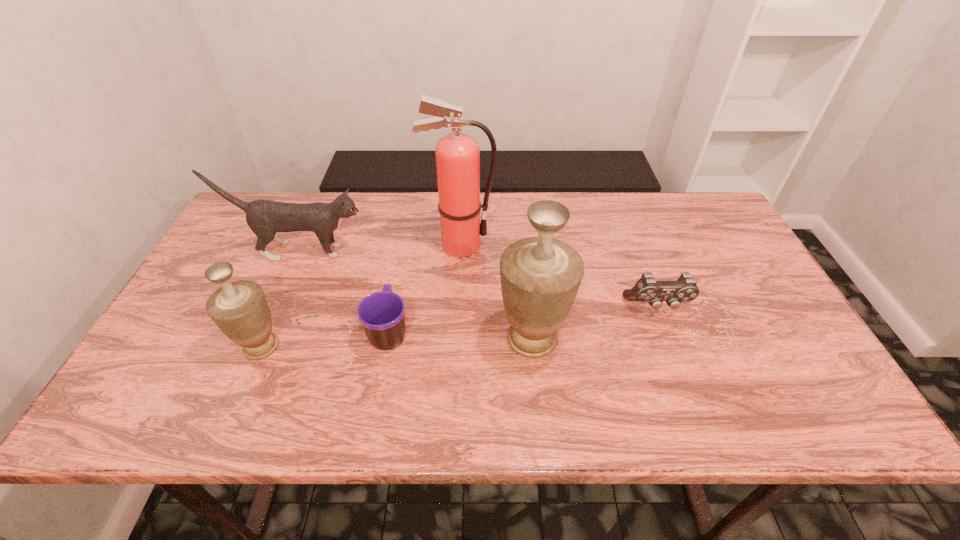
Identify the location of blank area at the left edge. The image size is (960, 540). (252, 254).

In the image, there is a desktop. What are the coordinates of `vacant area at the right edge` in the screenshot? It's located at (737, 277).

This screenshot has width=960, height=540. I want to click on vacant point at the far right corner, so click(x=672, y=209).

You are a GUI agent. You are given a task and a screenshot of the screen. Output one action in this format:
    pyautogui.click(x=<x>, y=<y>)
    Task: Click on the free area in between the control and the shorter urn
    
    Given the screenshot: What is the action you would take?
    pyautogui.click(x=460, y=326)

Where is `free space between the shorter urn and the fire extinguisher`? free space between the shorter urn and the fire extinguisher is located at coordinates (360, 296).

Identify the location of unoccupied position between the control and the cat. The width and height of the screenshot is (960, 540). (479, 279).

Locate an element on the screen. free spot between the taller urn and the cat is located at coordinates pos(417,295).

At what (x,y) coordinates should I click in order to perform the action: click on vacant space in between the third object from left to right and the right urn. Please return your answer as a coordinate pair (x, y). Looking at the image, I should click on (461, 335).

The width and height of the screenshot is (960, 540). In order to click on free space between the shorter urn and the cat in this screenshot , I will do `click(281, 299)`.

Locate an element on the screen. The image size is (960, 540). free space between the taller urn and the cat is located at coordinates (417, 295).